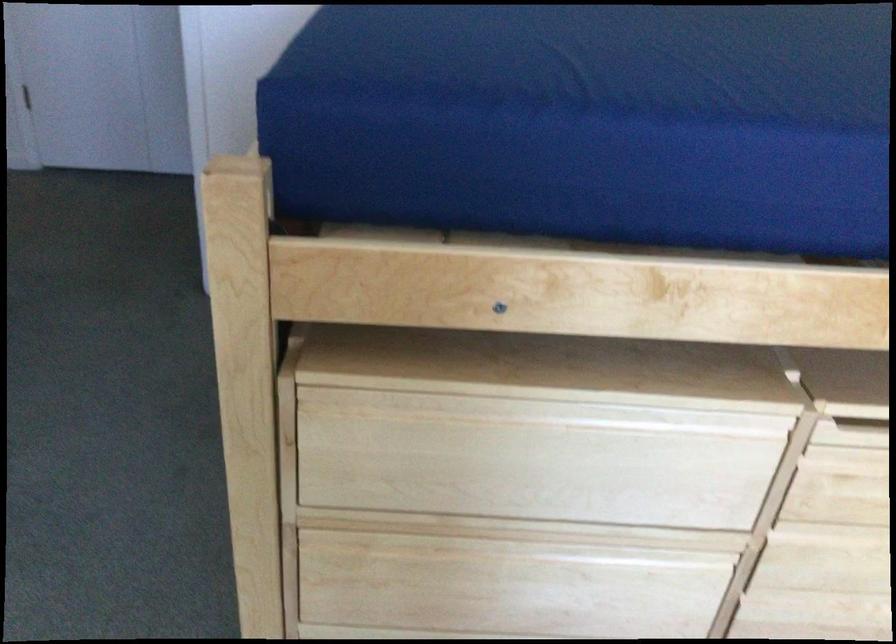
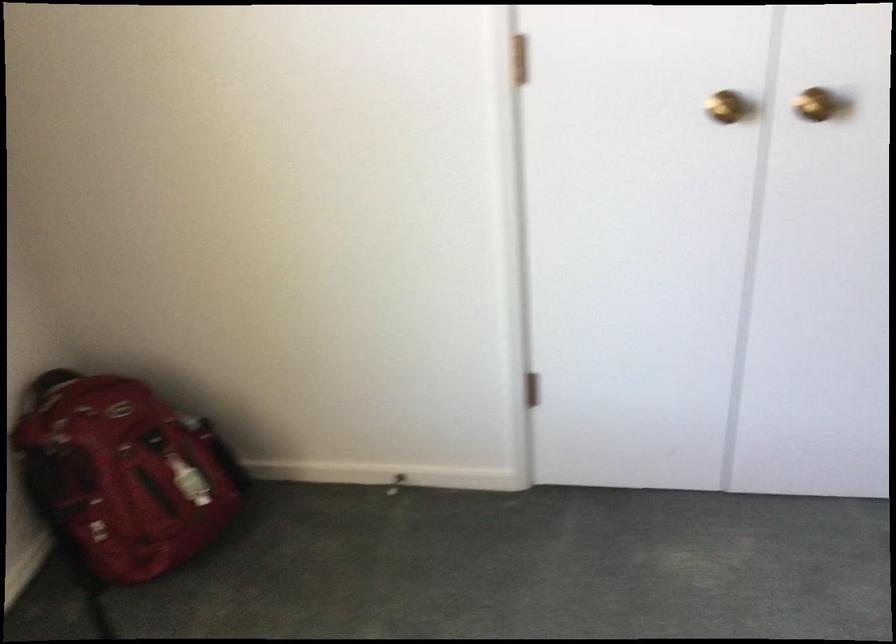
First-person continuous shooting, in which direction is the camera rotating?

The camera's rotation is toward left-down.